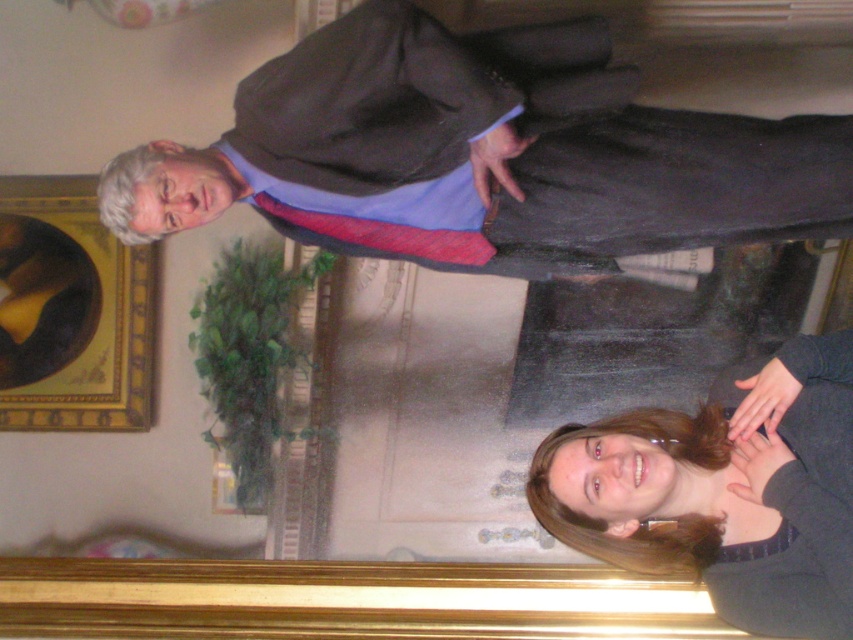
In the scene shown: You are standing in front of the large ornate painting and want to touch the dark brown hair at lower right. The point you need to reach is at coordinate point (x=724, y=492). Is this point located on the dark brown hair at lower right?

Yes, the point (x=724, y=492) is on the dark brown hair at lower right according to the description.

You are an interior designer assessing the placement of objects in a room. You notice the matte black suit at upper center and the goldwooden frame at upper left. Which object is located higher up in the image?

The matte black suit at upper center is positioned over the goldwooden frame at upper left, meaning it is higher up in the image.

You are a photographer setting up for a group photo. You see the matte black suit at upper center and the dark brown hair at lower right. Which object is positioned more to the left side of the image?

The matte black suit at upper center is positioned more to the left side of the image compared to the dark brown hair at lower right.